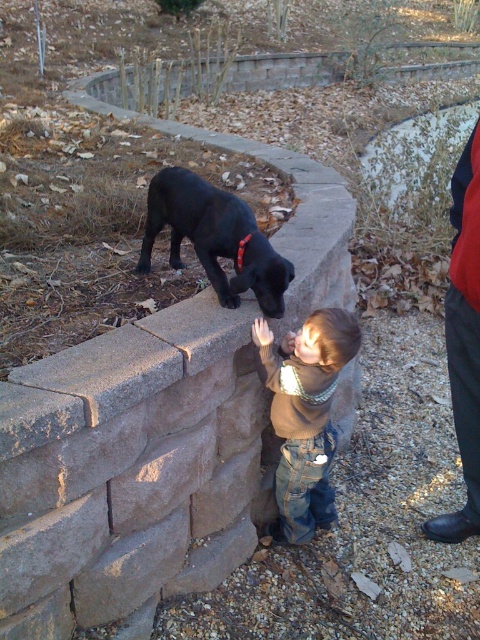
Question: Does black matte dog at upper center have a smaller size compared to red fabric pants at right?

Choices:
 (A) no
 (B) yes

Answer: (B)

Question: Which point is closer to the camera?

Choices:
 (A) (294, 401)
 (B) (471, 208)
 (C) (253, 234)

Answer: (B)

Question: Where is black matte dog at upper center located in relation to red fabric pants at right in the image?

Choices:
 (A) below
 (B) above

Answer: (B)

Question: Based on their relative distances, which object is nearer to the red fabric pants at right?

Choices:
 (A) black matte dog at upper center
 (B) brown fuzzy sweater at center

Answer: (B)

Question: Which is farther from the red fabric pants at right?

Choices:
 (A) black matte dog at upper center
 (B) brown fuzzy sweater at center

Answer: (A)

Question: Can you confirm if brown fuzzy sweater at center is bigger than red fabric pants at right?

Choices:
 (A) no
 (B) yes

Answer: (A)